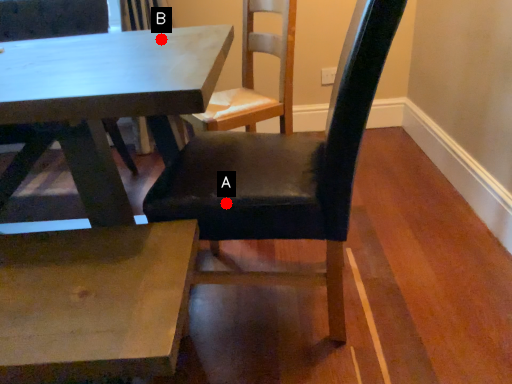
Question: Two points are circled on the image, labeled by A and B beside each circle. Which point is closer to the camera?

Choices:
 (A) A is closer
 (B) B is closer

Answer: (A)